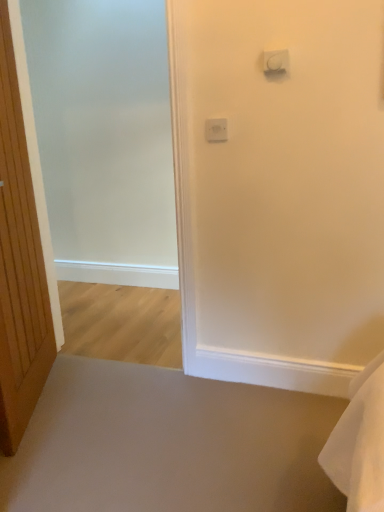
Question: Does white plastic light switch at upper center, the 1th light switch from the bottom, appear on the right side of white plastic light switch at upper center, which is counted as the second light switch, starting from the bottom?

Choices:
 (A) no
 (B) yes

Answer: (A)

Question: Is white plastic light switch at upper center, which appears as the first light switch when viewed from the back, wider than white plastic light switch at upper center, which is the second light switch in back-to-front order?

Choices:
 (A) yes
 (B) no

Answer: (B)

Question: Are white plastic light switch at upper center, positioned as the second light switch in top-to-bottom order, and white plastic light switch at upper center, the first light switch when ordered from front to back, far apart?

Choices:
 (A) yes
 (B) no

Answer: (B)

Question: Is white plastic light switch at upper center, the second light switch when ordered from right to left, next to white plastic light switch at upper center, the first light switch when ordered from front to back, and touching it?

Choices:
 (A) no
 (B) yes

Answer: (A)

Question: From the image's perspective, is white plastic light switch at upper center, which appears as the first light switch when viewed from the back, beneath white plastic light switch at upper center, the 2th light switch viewed from the left?

Choices:
 (A) yes
 (B) no

Answer: (A)

Question: From the image's perspective, is white plastic light switch at upper center, the 1th light switch positioned from the left, located above or below white plastic light switch at upper center, the first light switch when ordered from front to back?

Choices:
 (A) above
 (B) below

Answer: (B)

Question: Considering the positions of white plastic light switch at upper center, the second light switch in the front-to-back sequence, and white plastic light switch at upper center, the 2th light switch viewed from the left, in the image, is white plastic light switch at upper center, the second light switch in the front-to-back sequence, taller or shorter than white plastic light switch at upper center, the 2th light switch viewed from the left,?

Choices:
 (A) tall
 (B) short

Answer: (A)

Question: From a real-world perspective, is white plastic light switch at upper center, the second light switch when ordered from right to left, positioned above or below white plastic light switch at upper center, which is counted as the second light switch, starting from the bottom?

Choices:
 (A) below
 (B) above

Answer: (A)

Question: Considering the relative positions of white plastic light switch at upper center, the second light switch in the front-to-back sequence, and white plastic light switch at upper center, which is the second light switch in back-to-front order, in the image provided, is white plastic light switch at upper center, the second light switch in the front-to-back sequence, to the left or to the right of white plastic light switch at upper center, which is the second light switch in back-to-front order,?

Choices:
 (A) right
 (B) left

Answer: (B)

Question: Is wooden door at left bigger or smaller than white plastic light switch at upper center, the 1th light switch from the bottom?

Choices:
 (A) small
 (B) big

Answer: (B)

Question: In the image, is wooden door at left positioned in front of or behind white plastic light switch at upper center, the second light switch when ordered from right to left?

Choices:
 (A) front
 (B) behind

Answer: (A)

Question: Is wooden door at left taller or shorter than white plastic light switch at upper center, positioned as the second light switch in top-to-bottom order?

Choices:
 (A) short
 (B) tall

Answer: (B)

Question: Is wooden door at left to the left or to the right of white plastic light switch at upper center, the second light switch when ordered from right to left, in the image?

Choices:
 (A) left
 (B) right

Answer: (A)

Question: Is point (170, 176) positioned closer to the camera than point (36, 311)?

Choices:
 (A) farther
 (B) closer

Answer: (A)

Question: Based on their sizes in the image, would you say frosted glass screen door at left is bigger or smaller than wooden door at left?

Choices:
 (A) small
 (B) big

Answer: (B)